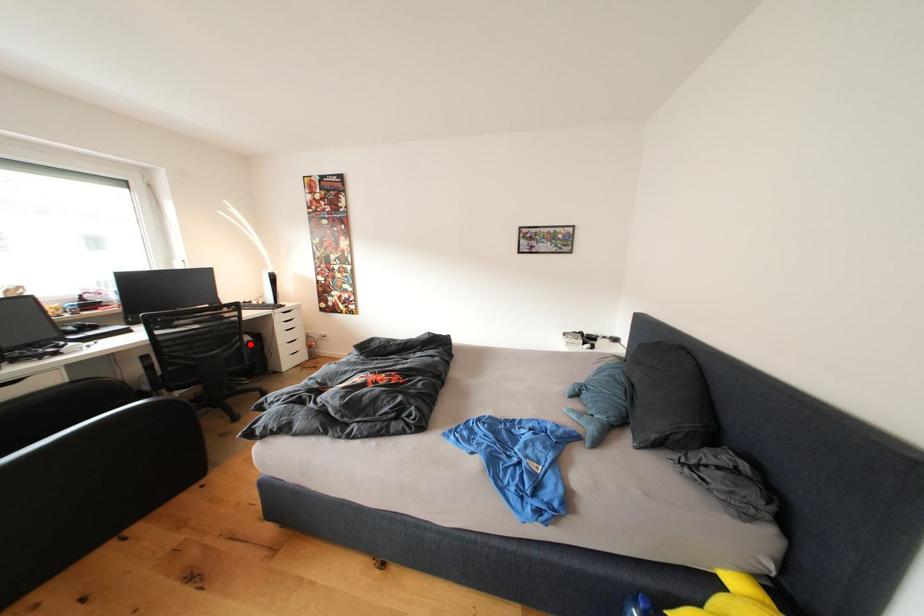
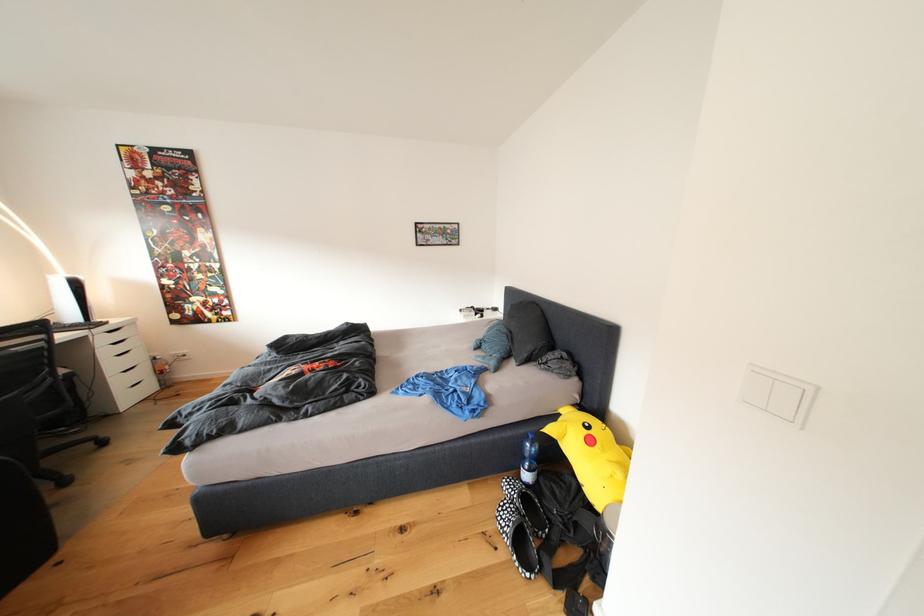
The point at the highlighted location is marked in the first image. Where is the corresponding point in the second image?

(63, 378)